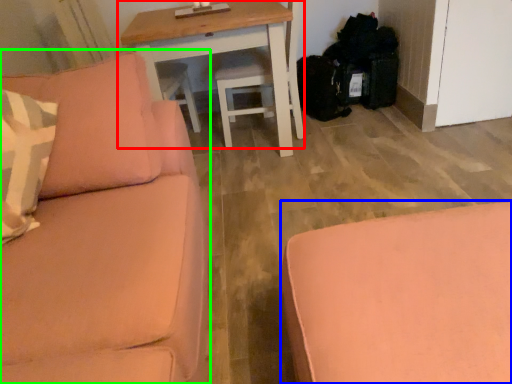
Question: Based on their relative distances, which object is farther from table (highlighted by a red box)? Choose from studio couch (highlighted by a blue box) and studio couch (highlighted by a green box).

Choices:
 (A) studio couch
 (B) studio couch

Answer: (A)